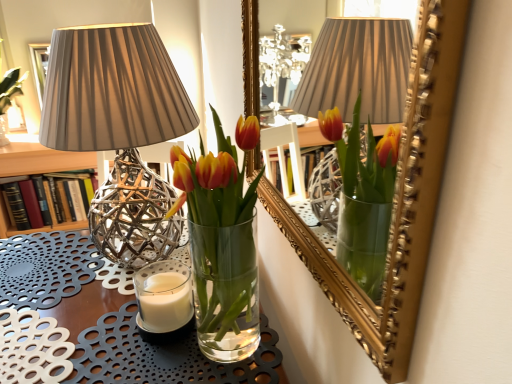
Identify the location of vacant space situated on the left part of white wax candle at lower left. Image resolution: width=512 pixels, height=384 pixels. (79, 317).